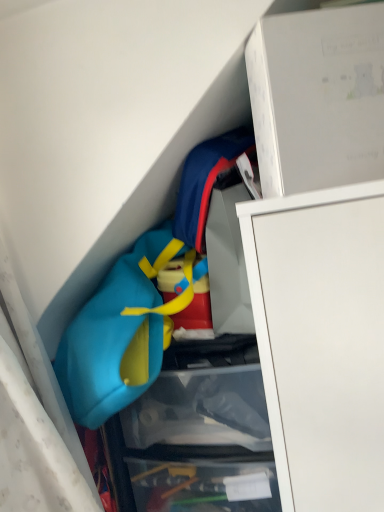
What is the approximate height of white cardboard box at upper right?

white cardboard box at upper right is 9.35 inches tall.

Measure the distance between point (290, 184) and camera.

They are 22.95 inches apart.

I want to click on white cardboard box at upper right, so [x=318, y=98].

This screenshot has height=512, width=384. Describe the element at coordinates (318, 98) in the screenshot. I see `white cardboard box at upper right` at that location.

Where is `white cardboard box at upper right`? white cardboard box at upper right is located at coordinates [x=318, y=98].